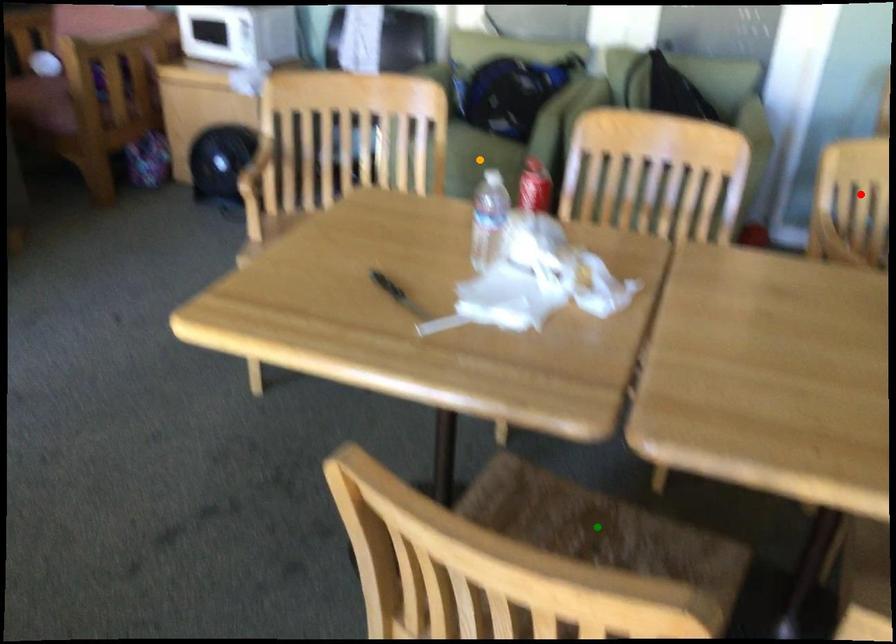
Order these from nearest to farthest:
orange point
green point
red point

orange point, red point, green point